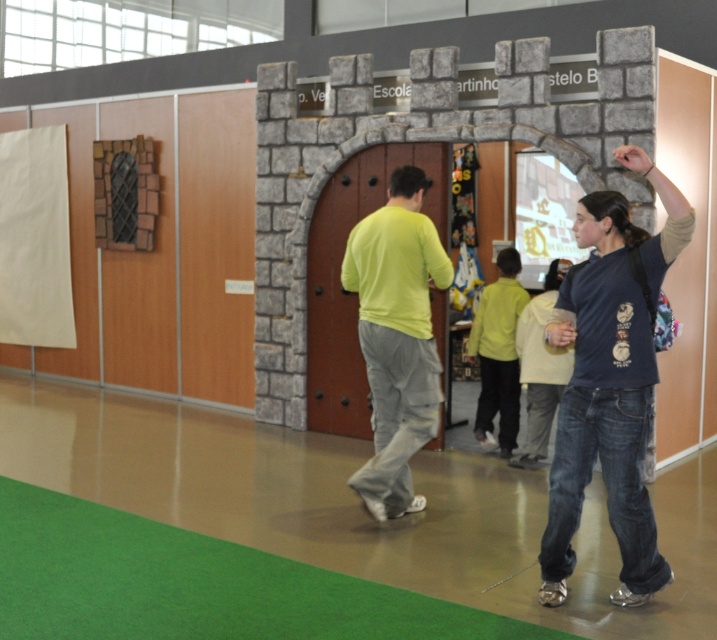
Can you confirm if dark blue t-shirt at right is positioned to the left of light green fabric shirt at center?

In fact, dark blue t-shirt at right is to the right of light green fabric shirt at center.

Image resolution: width=717 pixels, height=640 pixels. What do you see at coordinates (609, 381) in the screenshot?
I see `dark blue t-shirt at right` at bounding box center [609, 381].

The image size is (717, 640). What are the coordinates of `dark blue t-shirt at right` in the screenshot? It's located at (609, 381).

You are a GUI agent. You are given a task and a screenshot of the screen. Output one action in this format:
    pyautogui.click(x=<x>, y=<y>)
    Task: Click on the dark blue t-shirt at right
    The width and height of the screenshot is (717, 640).
    Given the screenshot: What is the action you would take?
    pyautogui.click(x=609, y=381)

Does point (391, 230) come behind point (523, 464)?

No.

Is light green fabric shirt at center below light yellow sweater at center?

Incorrect, light green fabric shirt at center is not positioned below light yellow sweater at center.

Who is more forward, (x=437, y=257) or (x=531, y=404)?

Point (x=437, y=257) is more forward.

Identify the location of light green fabric shirt at center. (397, 337).

Who is positioned more to the left, matte green shirt at center or light yellow sweater at center?

matte green shirt at center is more to the left.

Does matte green shirt at center have a smaller size compared to light yellow sweater at center?

Yes.

Is point (485, 397) positioned before point (531, 316)?

No, (485, 397) is behind (531, 316).

You are a GUI agent. You are given a task and a screenshot of the screen. Output one action in this format:
    pyautogui.click(x=<x>, y=<y>)
    Task: Click on the matte green shirt at center
    
    Given the screenshot: What is the action you would take?
    pyautogui.click(x=498, y=353)